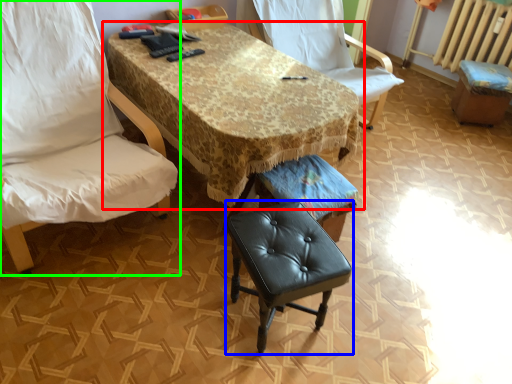
Question: Based on their relative distances, which object is nearer to table (highlighted by a red box)? Choose from stool (highlighted by a blue box) and chair (highlighted by a green box).

Choices:
 (A) stool
 (B) chair

Answer: (B)